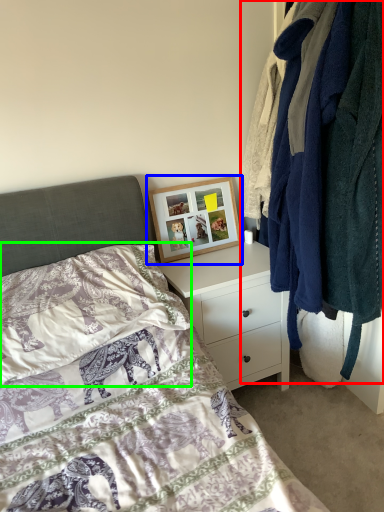
Question: Which object is positioned farthest from closet (highlighted by a red box)? Select from picture frame (highlighted by a blue box) and pillow (highlighted by a green box).

Choices:
 (A) picture frame
 (B) pillow

Answer: (B)